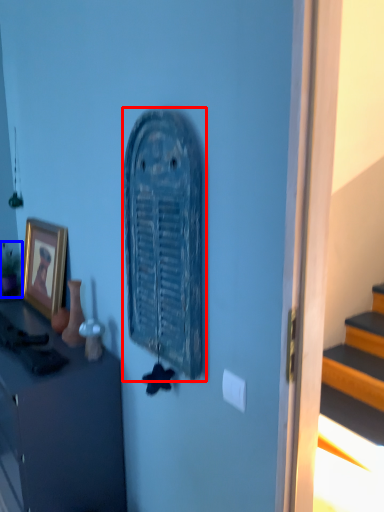
Question: Which point is closer to the camera, art (highlighted by a red box) or houseplant (highlighted by a blue box)?

Choices:
 (A) art
 (B) houseplant

Answer: (A)